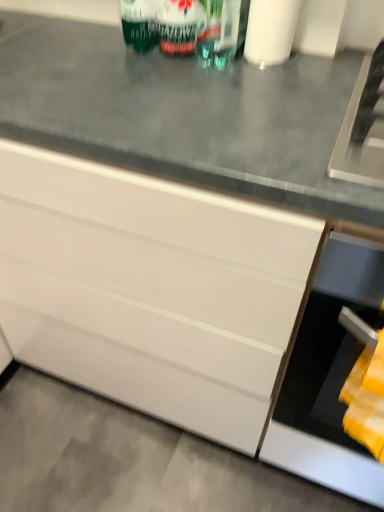
The width and height of the screenshot is (384, 512). What are the coordinates of `free space in front of white matte toilet paper at upper center` in the screenshot? It's located at (276, 89).